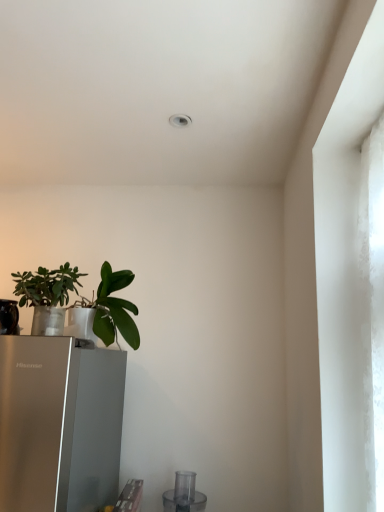
Question: Can you confirm if green matte plant at left, the first houseplant when ordered from left to right, is wider than green matte leafy plant at lower left, which is the 2th houseplant in left-to-right order?

Choices:
 (A) no
 (B) yes

Answer: (B)

Question: Is green matte plant at left, acting as the 2th houseplant starting from the right, touching green matte leafy plant at lower left, which is counted as the 1th houseplant, starting from the right?

Choices:
 (A) yes
 (B) no

Answer: (B)

Question: Is green matte plant at left, the first houseplant when ordered from left to right, outside green matte leafy plant at lower left, which is counted as the 1th houseplant, starting from the right?

Choices:
 (A) no
 (B) yes

Answer: (B)

Question: From a real-world perspective, is green matte plant at left, acting as the 2th houseplant starting from the right, physically below green matte leafy plant at lower left, which is counted as the 1th houseplant, starting from the right?

Choices:
 (A) yes
 (B) no

Answer: (A)

Question: Does green matte plant at left, the first houseplant when ordered from left to right, have a lesser height compared to green matte leafy plant at lower left, which is counted as the 1th houseplant, starting from the right?

Choices:
 (A) no
 (B) yes

Answer: (B)

Question: Considering the relative positions of green matte leafy plant at lower left, which is counted as the 1th houseplant, starting from the right, and transparent plastic blender at lower center in the image provided, is green matte leafy plant at lower left, which is counted as the 1th houseplant, starting from the right, to the left or to the right of transparent plastic blender at lower center?

Choices:
 (A) left
 (B) right

Answer: (A)

Question: In terms of width, does green matte leafy plant at lower left, which is counted as the 1th houseplant, starting from the right, look wider or thinner when compared to transparent plastic blender at lower center?

Choices:
 (A) wide
 (B) thin

Answer: (B)

Question: Which is correct: green matte leafy plant at lower left, which is counted as the 1th houseplant, starting from the right, is inside transparent plastic blender at lower center, or outside of it?

Choices:
 (A) outside
 (B) inside

Answer: (A)

Question: Does point (105, 274) appear closer or farther from the camera than point (173, 502)?

Choices:
 (A) closer
 (B) farther

Answer: (A)

Question: From a real-world perspective, relative to transparent plastic blender at lower center, is green matte plant at left, the first houseplant when ordered from left to right, vertically above or below?

Choices:
 (A) below
 (B) above

Answer: (B)

Question: Is green matte plant at left, the first houseplant when ordered from left to right, situated inside transparent plastic blender at lower center or outside?

Choices:
 (A) inside
 (B) outside

Answer: (B)

Question: Looking at the image, does green matte plant at left, the first houseplant when ordered from left to right, seem bigger or smaller compared to transparent plastic blender at lower center?

Choices:
 (A) small
 (B) big

Answer: (B)

Question: Relative to transparent plastic blender at lower center, is green matte plant at left, the first houseplant when ordered from left to right, in front or behind?

Choices:
 (A) front
 (B) behind

Answer: (A)

Question: Do you think transparent plastic blender at lower center is within green matte leafy plant at lower left, which is the 2th houseplant in left-to-right order, or outside of it?

Choices:
 (A) outside
 (B) inside

Answer: (A)

Question: Looking at the image, does transparent plastic blender at lower center seem bigger or smaller compared to green matte leafy plant at lower left, which is the 2th houseplant in left-to-right order?

Choices:
 (A) big
 (B) small

Answer: (B)